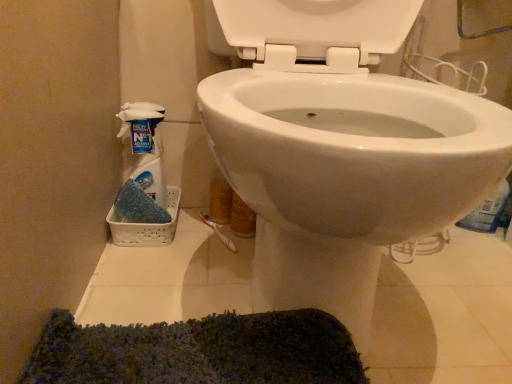
At what (x,y) coordinates should I click in order to perform the action: click on white glossy toilet at center. Please return your answer as a coordinate pair (x, y). The width and height of the screenshot is (512, 384). Looking at the image, I should click on (341, 148).

What do you see at coordinates (341, 148) in the screenshot?
I see `white glossy toilet at center` at bounding box center [341, 148].

Locate an element on the screen. This screenshot has height=384, width=512. translucent plastic spray bottle at left is located at coordinates (145, 146).

This screenshot has width=512, height=384. What do you see at coordinates (145, 146) in the screenshot? I see `translucent plastic spray bottle at left` at bounding box center [145, 146].

At what (x,y) coordinates should I click in order to perform the action: click on white glossy toilet at center. Please return your answer as a coordinate pair (x, y). The height and width of the screenshot is (384, 512). Looking at the image, I should click on (341, 148).

Is translucent plastic spray bottle at left to the left or to the right of white glossy toilet at center in the image?

translucent plastic spray bottle at left is to the left of white glossy toilet at center.

Between translucent plastic spray bottle at left and white glossy toilet at center, which one is positioned behind?

translucent plastic spray bottle at left is further from the camera.

Is point (160, 184) closer or farther from the camera than point (402, 197)?

Point (160, 184).

From the image's perspective, who appears lower, translucent plastic spray bottle at left or white glossy toilet at center?

translucent plastic spray bottle at left appears lower in the image.

From a real-world perspective, who is located lower, translucent plastic spray bottle at left or white glossy toilet at center?

translucent plastic spray bottle at left.

Does translucent plastic spray bottle at left have a greater width compared to white glossy toilet at center?

Incorrect, the width of translucent plastic spray bottle at left does not surpass that of white glossy toilet at center.

Considering the relative sizes of translucent plastic spray bottle at left and white glossy toilet at center in the image provided, is translucent plastic spray bottle at left taller than white glossy toilet at center?

No.

Can you confirm if translucent plastic spray bottle at left is bigger than white glossy toilet at center?

No.

Is white glossy toilet at center inside translucent plastic spray bottle at left?

That's incorrect, white glossy toilet at center is not inside translucent plastic spray bottle at left.

Are translucent plastic spray bottle at left and white glossy toilet at center beside each other?

translucent plastic spray bottle at left and white glossy toilet at center are clearly separated.

Looking at this image, could you tell me if translucent plastic spray bottle at left is turned towards white glossy toilet at center?

No, translucent plastic spray bottle at left is not facing towards white glossy toilet at center.

In the image, there is a white glossy toilet at center. Identify the location of cleaning product below it (from a real-world perspective). Image resolution: width=512 pixels, height=384 pixels. (145, 146).

Considering the positions of objects white glossy toilet at center and translucent plastic spray bottle at left in the image provided, who is more to the right, white glossy toilet at center or translucent plastic spray bottle at left?

white glossy toilet at center is more to the right.

Which object is closer to the camera taking this photo, white glossy toilet at center or translucent plastic spray bottle at left?

white glossy toilet at center.

Which point is more distant from viewer, (310,204) or (140,155)?

Positioned behind is point (140,155).

From the image's perspective, is white glossy toilet at center beneath translucent plastic spray bottle at left?

Incorrect, from the image's perspective, white glossy toilet at center is higher than translucent plastic spray bottle at left.

From a real-world perspective, who is located higher, white glossy toilet at center or translucent plastic spray bottle at left?

In real-world perspective, white glossy toilet at center is above.

In terms of width, does white glossy toilet at center look wider or thinner when compared to translucent plastic spray bottle at left?

Considering their sizes, white glossy toilet at center looks broader than translucent plastic spray bottle at left.

Considering the sizes of white glossy toilet at center and translucent plastic spray bottle at left in the image, is white glossy toilet at center taller or shorter than translucent plastic spray bottle at left?

Considering their sizes, white glossy toilet at center has more height than translucent plastic spray bottle at left.

Between white glossy toilet at center and translucent plastic spray bottle at left, which one has larger size?

white glossy toilet at center is bigger.

Would you say white glossy toilet at center is inside or outside translucent plastic spray bottle at left?

white glossy toilet at center is located beyond the bounds of translucent plastic spray bottle at left.

Can you see white glossy toilet at center touching translucent plastic spray bottle at left?

No, white glossy toilet at center is not touching translucent plastic spray bottle at left.

Could you tell me if white glossy toilet at center is facing translucent plastic spray bottle at left?

No, white glossy toilet at center is not oriented towards translucent plastic spray bottle at left.

How distant is white glossy toilet at center from translucent plastic spray bottle at left?

They are 16.58 inches apart.

Where is `cleaning product on the left of the white glossy toilet at center`? The width and height of the screenshot is (512, 384). cleaning product on the left of the white glossy toilet at center is located at coordinates (145, 146).

Find the location of `cleaning product below the white glossy toilet at center (from the image's perspective)`. cleaning product below the white glossy toilet at center (from the image's perspective) is located at coordinates (145, 146).

Image resolution: width=512 pixels, height=384 pixels. What are the coordinates of `cleaning product below the white glossy toilet at center (from a real-world perspective)` in the screenshot? It's located at (145, 146).